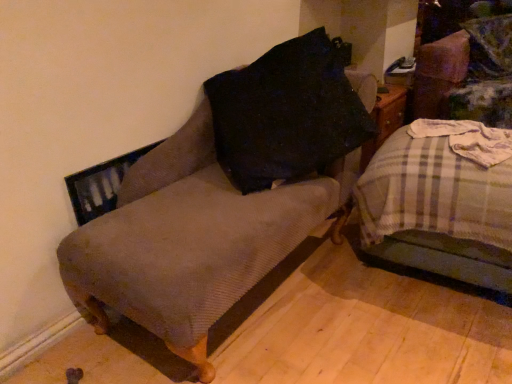
This screenshot has height=384, width=512. What are the coordinates of `plaid fabric bed at right` in the screenshot? It's located at (438, 210).

The height and width of the screenshot is (384, 512). I want to click on velvet green swivel chair at upper right, so click(x=469, y=69).

The width and height of the screenshot is (512, 384). Describe the element at coordinates (221, 197) in the screenshot. I see `textured brown armchair at left` at that location.

Identify the location of textured brown armchair at left. The height and width of the screenshot is (384, 512). (221, 197).

Locate an element on the screen. plaid fabric bed at right is located at coordinates (438, 210).

Identify the location of furniture to the left of plaid fabric bed at right. (221, 197).

From a real-world perspective, relative to plaid fabric bed at right, is textured brown armchair at left vertically above or below?

textured brown armchair at left is situated higher than plaid fabric bed at right in the real world.

Visually, is textured brown armchair at left positioned to the left or to the right of plaid fabric bed at right?

Clearly, textured brown armchair at left is on the left of plaid fabric bed at right in the image.

Considering the relative sizes of textured brown armchair at left and plaid fabric bed at right in the image provided, is textured brown armchair at left smaller than plaid fabric bed at right?

No.

In the scene shown: Which point is more forward, (93, 296) or (426, 57)?

The point (93, 296) is in front.

Do you think textured brown armchair at left is within velvet green swivel chair at upper right, or outside of it?

The correct answer is: outside.

Between textured brown armchair at left and velvet green swivel chair at upper right, which one has more height?

Standing taller between the two is textured brown armchair at left.

In terms of height, does plaid fabric bed at right look taller or shorter compared to textured brown armchair at left?

Clearly, plaid fabric bed at right is shorter compared to textured brown armchair at left.

From a real-world perspective, which is physically above, plaid fabric bed at right or textured brown armchair at left?

From a 3D spatial view, textured brown armchair at left is above.

Considering the positions of objects plaid fabric bed at right and textured brown armchair at left in the image provided, who is more to the left, plaid fabric bed at right or textured brown armchair at left?

textured brown armchair at left is more to the left.

Would you say plaid fabric bed at right is outside textured brown armchair at left?

Absolutely, plaid fabric bed at right is external to textured brown armchair at left.

From the image's perspective, which object appears higher, velvet green swivel chair at upper right or plaid fabric bed at right?

velvet green swivel chair at upper right appears higher in the image.

Which object is further away from the camera taking this photo, velvet green swivel chair at upper right or plaid fabric bed at right?

Positioned behind is velvet green swivel chair at upper right.

Is velvet green swivel chair at upper right positioned with its back to plaid fabric bed at right?

No, velvet green swivel chair at upper right's orientation is not away from plaid fabric bed at right.

From a real-world perspective, is velvet green swivel chair at upper right located beneath plaid fabric bed at right?

No.

Is textured brown armchair at left completely or partially inside velvet green swivel chair at upper right?

No, textured brown armchair at left is not surrounded by velvet green swivel chair at upper right.

Who is smaller, velvet green swivel chair at upper right or textured brown armchair at left?

With smaller size is velvet green swivel chair at upper right.

This screenshot has height=384, width=512. I want to click on swivel chair above the textured brown armchair at left (from a real-world perspective), so click(x=469, y=69).

Does velvet green swivel chair at upper right appear on the right side of textured brown armchair at left?

Yes, velvet green swivel chair at upper right is to the right of textured brown armchair at left.

Is plaid fabric bed at right spatially inside velvet green swivel chair at upper right, or outside of it?

plaid fabric bed at right is not inside velvet green swivel chair at upper right, it's outside.

Is point (436, 264) less distant than point (423, 110)?

Yes, it is.

In the scene shown: Between plaid fabric bed at right and velvet green swivel chair at upper right, which one has smaller width?

velvet green swivel chair at upper right.

Is plaid fabric bed at right beside velvet green swivel chair at upper right?

plaid fabric bed at right and velvet green swivel chair at upper right are clearly separated.

The image size is (512, 384). Find the location of `furniture that appears above the plaid fabric bed at right (from a real-world perspective)`. furniture that appears above the plaid fabric bed at right (from a real-world perspective) is located at coordinates (221, 197).

The image size is (512, 384). In the image, there is a textured brown armchair at left. Identify the location of swivel chair above it (from the image's perspective). (469, 69).

From the picture: From the image, which object appears to be farther from velvet green swivel chair at upper right, plaid fabric bed at right or textured brown armchair at left?

textured brown armchair at left is further to velvet green swivel chair at upper right.

Estimate the real-world distances between objects in this image. Which object is closer to plaid fabric bed at right, velvet green swivel chair at upper right or textured brown armchair at left?

Based on the image, textured brown armchair at left appears to be nearer to plaid fabric bed at right.

Looking at the image, which one is located closer to plaid fabric bed at right, textured brown armchair at left or velvet green swivel chair at upper right?

textured brown armchair at left is closer to plaid fabric bed at right.

Based on their spatial positions, is velvet green swivel chair at upper right or plaid fabric bed at right further from textured brown armchair at left?

velvet green swivel chair at upper right.

From the image, which object appears to be farther from textured brown armchair at left, plaid fabric bed at right or velvet green swivel chair at upper right?

velvet green swivel chair at upper right is positioned further to the anchor textured brown armchair at left.

In the scene shown: Based on their spatial positions, is textured brown armchair at left or plaid fabric bed at right further from velvet green swivel chair at upper right?

textured brown armchair at left lies further to velvet green swivel chair at upper right than the other object.

Locate an element on the screen. This screenshot has height=384, width=512. studio couch between textured brown armchair at left and velvet green swivel chair at upper right from left to right is located at coordinates (438, 210).